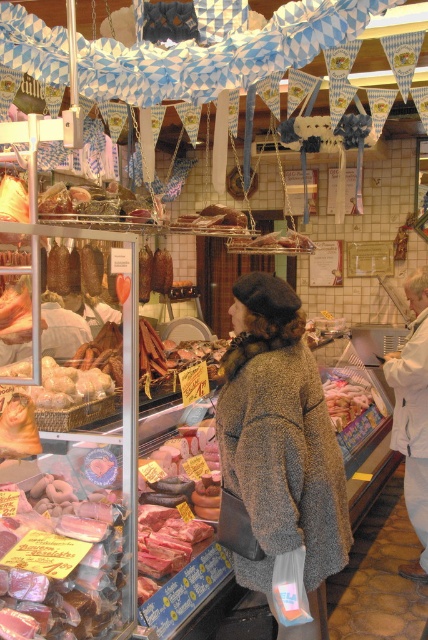
Question: Which of the following is the closest to the observer?

Choices:
 (A) (347, 397)
 (B) (86, 577)

Answer: (B)

Question: Is fuzzy brown coat at center smaller than pink glossy meat at lower left?

Choices:
 (A) yes
 (B) no

Answer: (B)

Question: Is fuzzy brown coat at center wider than pink glossy meat at lower left?

Choices:
 (A) yes
 (B) no

Answer: (A)

Question: Which object is closer to the camera taking this photo?

Choices:
 (A) fuzzy brown coat at center
 (B) smooth pink sausage at center
 (C) pink glossy meat at lower left

Answer: (C)

Question: Based on their relative distances, which object is farther from the smooth pink sausage at center?

Choices:
 (A) pink glossy meat at lower left
 (B) fuzzy brown coat at center

Answer: (A)

Question: Is pink glossy meat at lower left wider than smooth pink sausage at center?

Choices:
 (A) no
 (B) yes

Answer: (A)